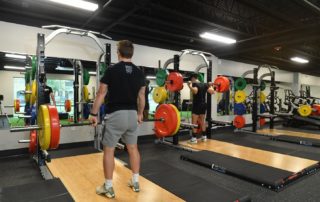
You are a GUI agent. You are given a task and a screenshot of the screen. Output one action in this format:
    pyautogui.click(x=<x>, y=<y>)
    Task: Click on the lights
    This screenshot has width=320, height=202.
    Given the screenshot: What is the action you would take?
    point(88,5), point(208,34)